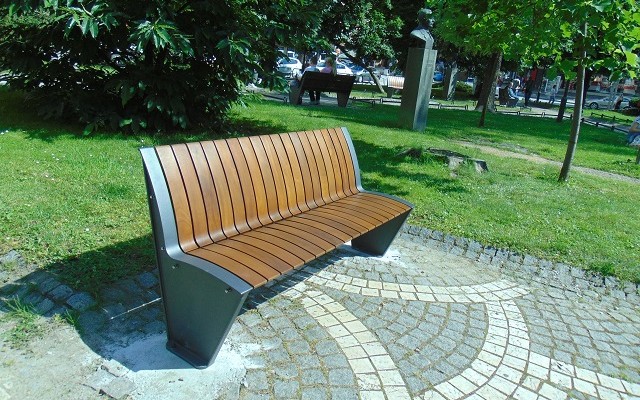
You are a GUI agent. You are given a task and a screenshot of the screen. Output one action in this format:
    pyautogui.click(x=<x>, y=<y>)
    Task: Click on the walk way
    This screenshot has width=640, height=400.
    Given the screenshot: What is the action you would take?
    pyautogui.click(x=500, y=149)